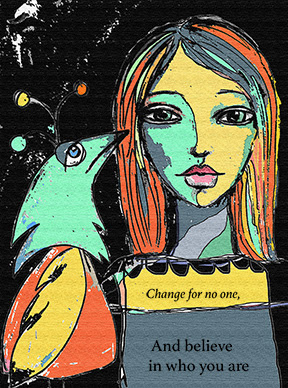
Locate an element on the screen. Image resolution: width=288 pixels, height=388 pixels. magazine is located at coordinates pos(222,140).